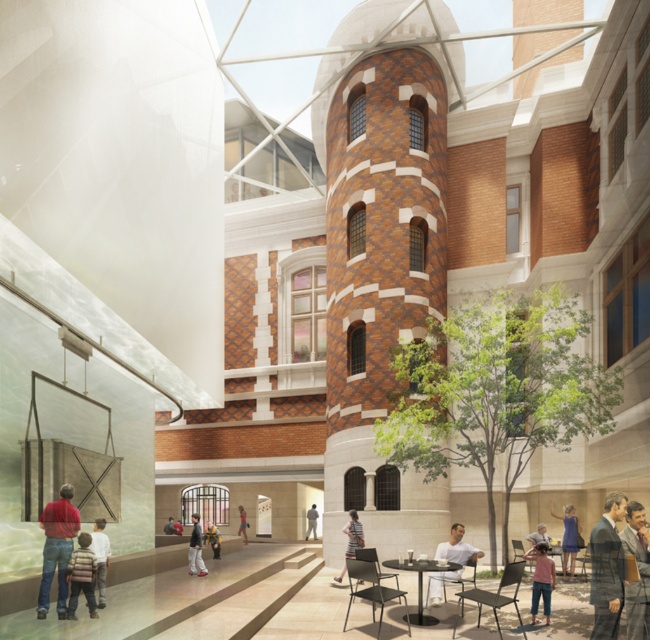
Question: Which object is closer to the camera taking this photo?

Choices:
 (A) pink cotton shirt at lower right
 (B) dark brown suit at center right
 (C) striped shirt at lower left
 (D) gray suit at lower right

Answer: (D)

Question: Can you confirm if dark brown suit at center right is thinner than pink fabric at lower center?

Choices:
 (A) yes
 (B) no

Answer: (B)

Question: Is white matte shirt at lower right smaller than light brown leather jacket at lower right?

Choices:
 (A) yes
 (B) no

Answer: (B)

Question: Which object appears closest to the camera in this image?

Choices:
 (A) gray fabric at center
 (B) denim jeans at lower left

Answer: (B)

Question: Does striped sweater at lower left have a lesser width compared to striped fabric shirt at center?

Choices:
 (A) yes
 (B) no

Answer: (B)

Question: Which object is closer to the camera taking this photo?

Choices:
 (A) striped fabric shirt at center
 (B) striped sweater at lower left
 (C) light brown leather jacket at center

Answer: (B)